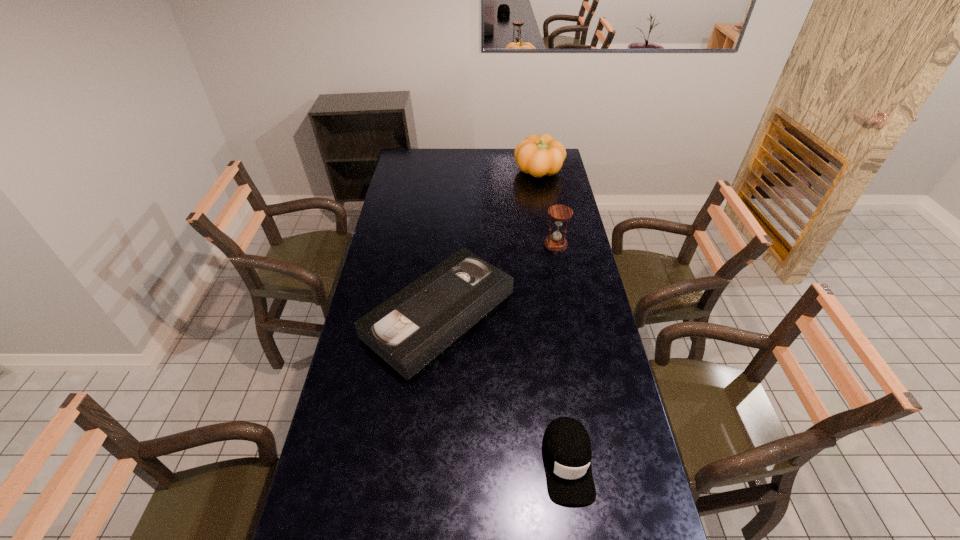
Find the location of a particular element. The image size is (960, 540). empty space between the shortest object and the farthest object is located at coordinates (489, 243).

You are a GUI agent. You are given a task and a screenshot of the screen. Output one action in this format:
    pyautogui.click(x=<x>, y=<y>)
    Task: Click on the vacant region between the second shortest object and the third nearest object
    
    Given the screenshot: What is the action you would take?
    pyautogui.click(x=562, y=353)

Find the location of a particular element. Image resolution: width=960 pixels, height=540 pixels. vacant area that lies between the second farthest object and the cap is located at coordinates (562, 353).

Identify the location of vacant space that's between the nearest object and the third farthest object. The image size is (960, 540). (503, 388).

The height and width of the screenshot is (540, 960). I want to click on free spot between the cap and the second tallest object, so click(x=562, y=353).

This screenshot has width=960, height=540. Find the location of `empty location between the cap and the pumpkin`. empty location between the cap and the pumpkin is located at coordinates (553, 318).

Locate which object is the closest to the shortest object. Please provide its 2D coordinates. Your answer should be formatted as a tuple, i.e. [(x, y)], where the tuple contains the x and y coordinates of a point satisfying the conditions above.

[(566, 446)]

Find the location of a particular element. This screenshot has height=540, width=960. object that stands as the third closest to the third shortest object is located at coordinates (566, 446).

Identify the location of blank area in the image that satisfies the following two spatial constraints: 1. on the back side of the pumpkin; 2. on the right side of the second nearest object. The width and height of the screenshot is (960, 540). (451, 172).

Locate an element on the screen. The height and width of the screenshot is (540, 960). free region that satisfies the following two spatial constraints: 1. on the back side of the leftmost object; 2. on the left side of the pumpkin is located at coordinates (451, 172).